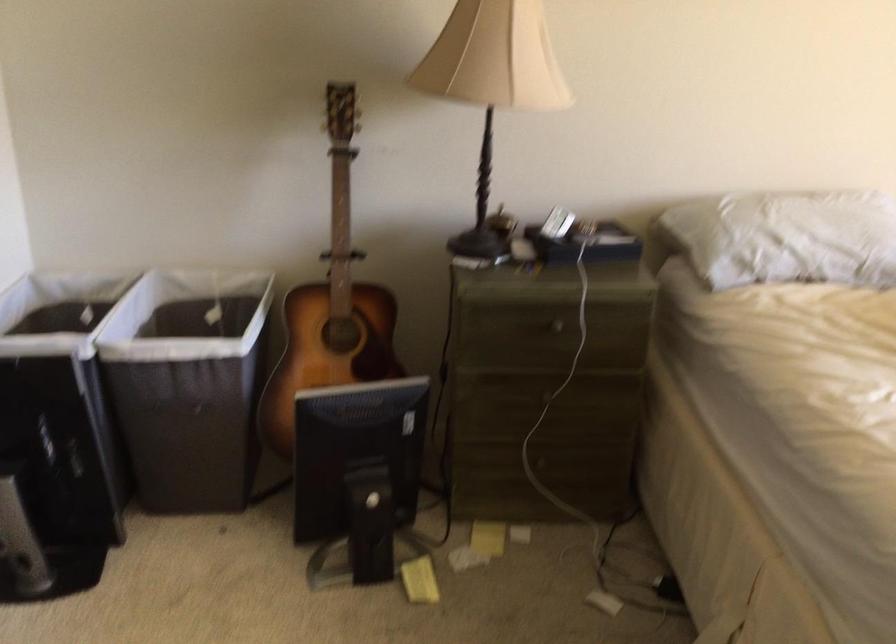
At what (x,y) coordinates should I click in order to perform the action: click on beige lampshade. Please return your answer as a coordinate pair (x, y). This screenshot has height=644, width=896. Looking at the image, I should click on (494, 58).